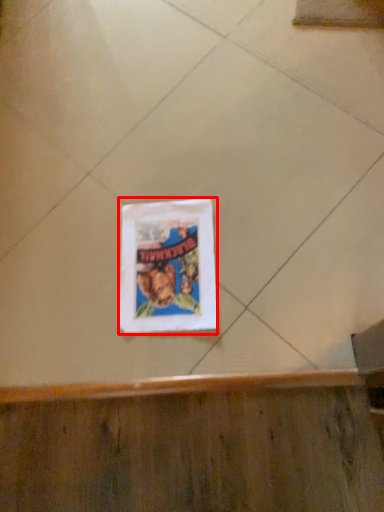
Question: From the image's perspective, considering the relative positions of picture frame (annotated by the red box) and ceramic tile in the image provided, where is picture frame (annotated by the red box) located with respect to the staircase?

Choices:
 (A) above
 (B) below

Answer: (B)